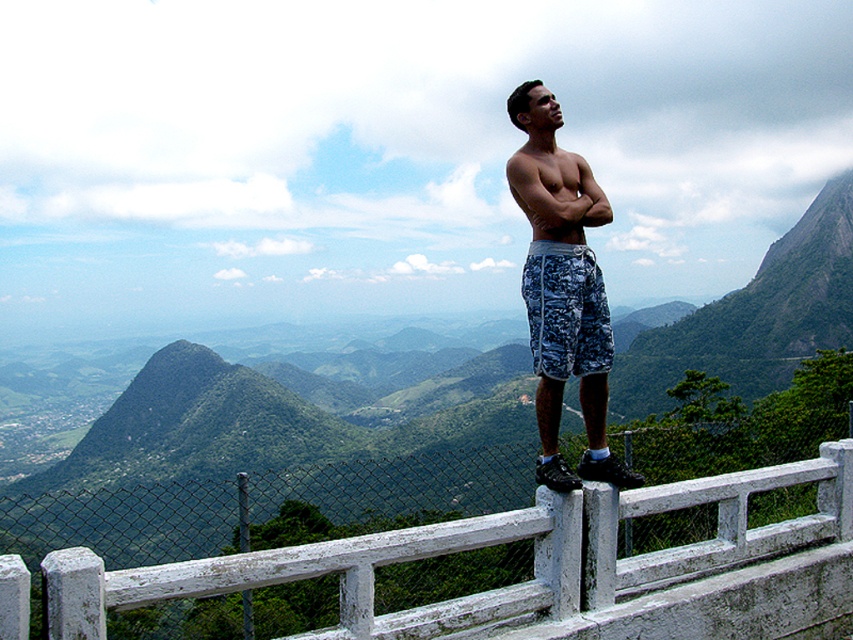
You are a safety inspector evaluating the scene. The safety regulation requires that the distance between the white concrete fence at upper center and the man must be at least 6 meters to prevent falls. Is the current distance compliant with the regulation?

The distance between the white concrete fence at upper center and the man is 5.40 meters, which is less than the required 6 meters. Therefore, the current distance does not comply with the safety regulation.

You are a photographer trying to capture the man in the scene. Since you want to ensure both the camouflage shorts at center and the muscular tan skin at upper center are clearly visible in the photo, which object should you focus on first to ensure proper exposure?

The camouflage shorts at center should be focused on first because it is larger than the muscular tan skin at upper center, making it easier to adjust exposure settings for the larger area before considering the smaller detail.

You are a safety inspector evaluating the scene. The safety regulations state that there must be at least 2 meters of distance between the railing and any person standing near it to prevent accidental falls. Based on the information provided, is the current distance between the white concrete fence at upper center and the camouflage shorts at center compliant with the safety regulations?

The distance between the white concrete fence at upper center and the camouflage shorts at center is 1.73 meters, which is less than the required 2 meters. Therefore, the current setup does not comply with the safety regulations.